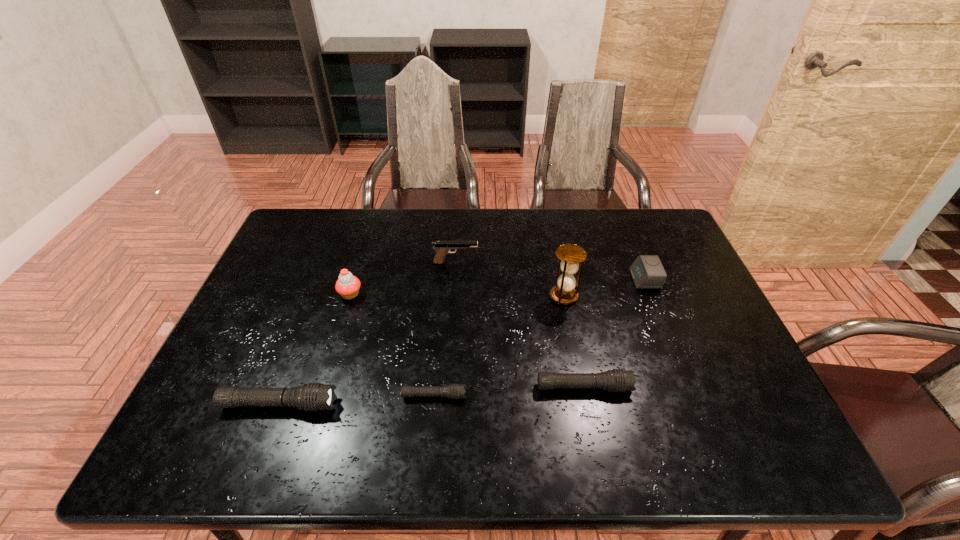
I want to click on object situated at the near left corner, so click(x=313, y=396).

Locate an element on the screen. vacant space at the far edge is located at coordinates (395, 241).

Where is `free location at the near edge`? The image size is (960, 540). free location at the near edge is located at coordinates (533, 409).

Locate an element on the screen. This screenshot has width=960, height=540. vacant space at the left edge is located at coordinates tap(240, 374).

Find the location of a particular element. The image size is (960, 540). vacant space at the right edge of the desktop is located at coordinates (717, 338).

In the image, there is a desktop. Where is `free space at the far left corner`? free space at the far left corner is located at coordinates (319, 233).

This screenshot has height=540, width=960. I want to click on vacant space at the near left corner, so click(x=209, y=415).

At what (x,y) coordinates should I click in order to perform the action: click on free space at the far right corner. Please return your answer as a coordinate pair (x, y). This screenshot has width=960, height=540. Looking at the image, I should click on (682, 251).

Find the location of `vacant space that's between the tallest object and the shortest object`. vacant space that's between the tallest object and the shortest object is located at coordinates (499, 346).

At what (x,y) coordinates should I click in order to perform the action: click on free space that is in between the second flashlight from right to left and the leftmost flashlight. Please return your answer as a coordinate pair (x, y). Looking at the image, I should click on (357, 400).